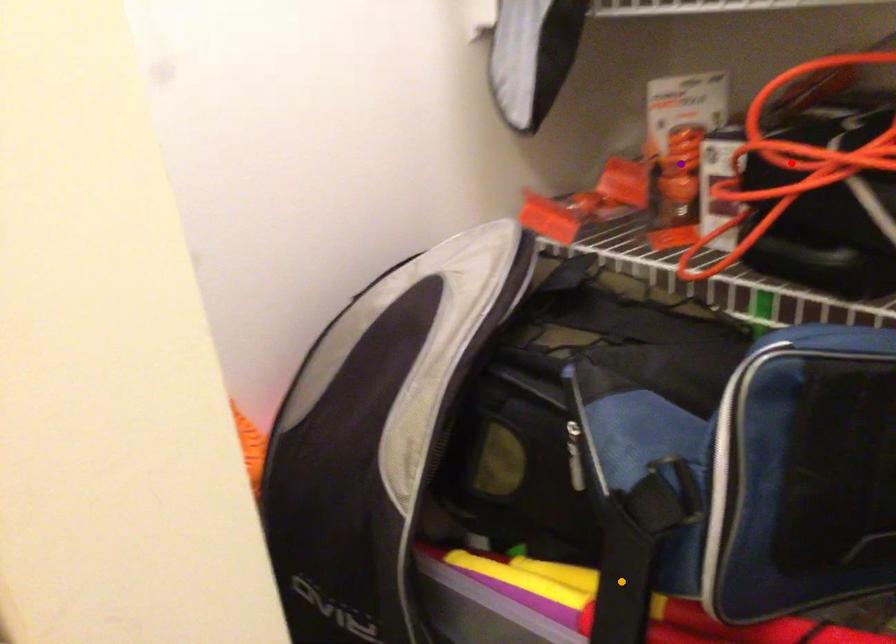
Order these from nearest to farthest:
purple point | orange point | red point

orange point < red point < purple point